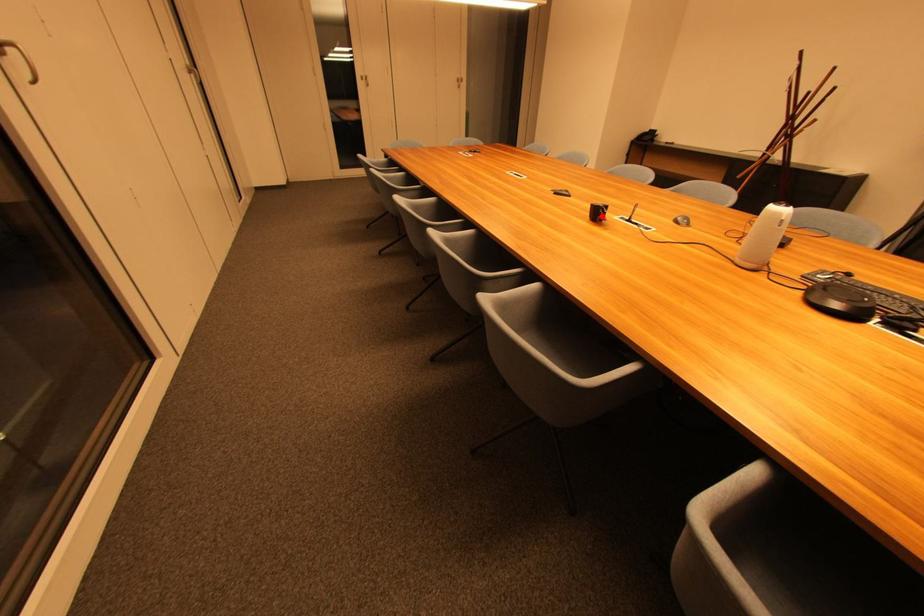
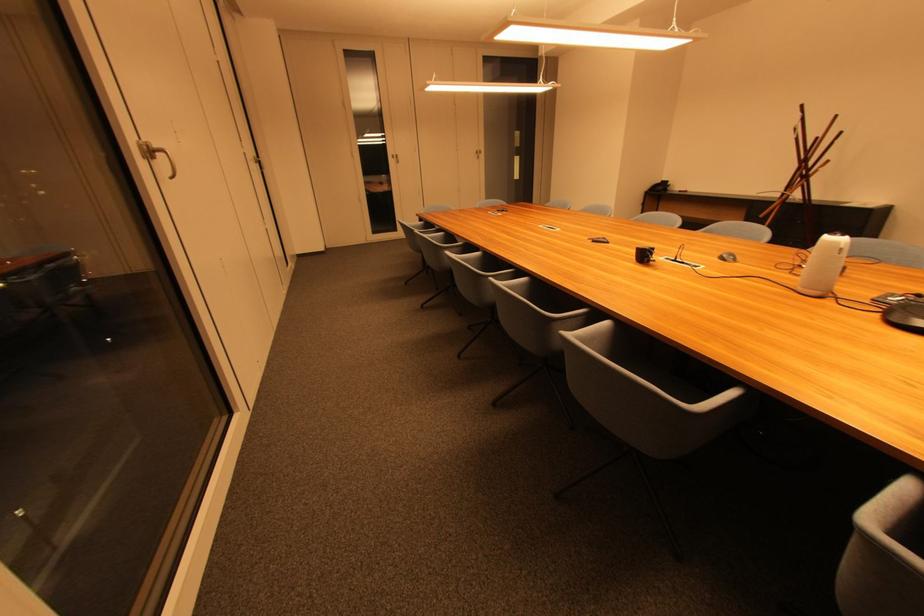
Where in the second image is the point corresponding to the highlighted location from the first image?

(649, 257)